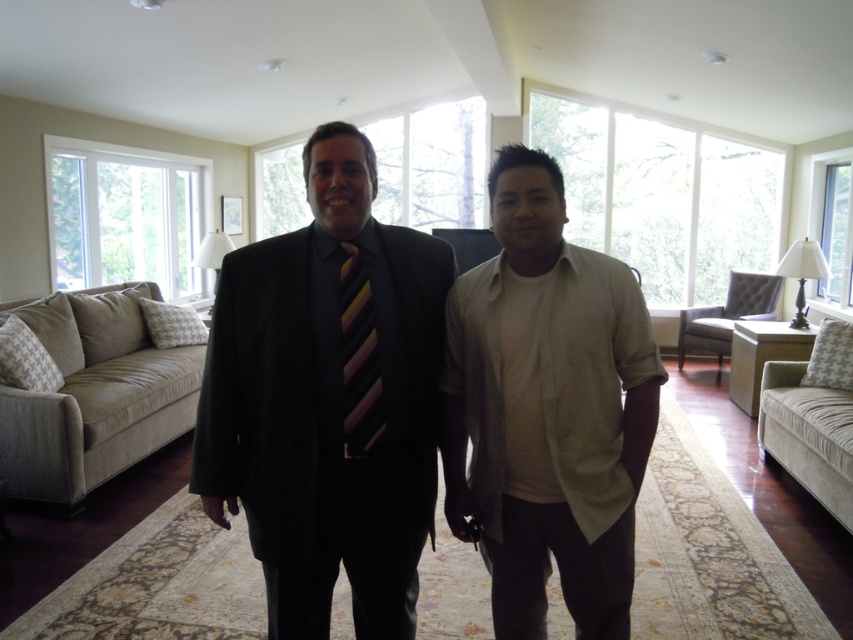
Is beige fabric sofa at left thinner than beige fabric armchair at right?

No, beige fabric sofa at left is not thinner than beige fabric armchair at right.

Can you confirm if beige fabric sofa at left is shorter than beige fabric armchair at right?

No, beige fabric sofa at left is not shorter than beige fabric armchair at right.

Is point (165, 387) farther from viewer compared to point (802, 449)?

Yes, it is behind point (802, 449).

Where is `beige fabric sofa at left`? This screenshot has height=640, width=853. beige fabric sofa at left is located at coordinates (94, 396).

Which is more to the left, dark blue wool suit at center or beige fabric armchair at right?

dark blue wool suit at center is more to the left.

Which of these two, dark blue wool suit at center or beige fabric armchair at right, stands shorter?

beige fabric armchair at right

Which is behind, point (305, 428) or point (846, 502)?

Point (846, 502)

The height and width of the screenshot is (640, 853). I want to click on dark blue wool suit at center, so click(x=326, y=422).

Does dark blue wool suit at center have a smaller size compared to beige fabric sofa at left?

Yes.

Is point (294, 460) farther from viewer compared to point (190, 388)?

No.

At what (x,y) coordinates should I click in order to perform the action: click on dark blue wool suit at center. Please return your answer as a coordinate pair (x, y). Looking at the image, I should click on (326, 422).